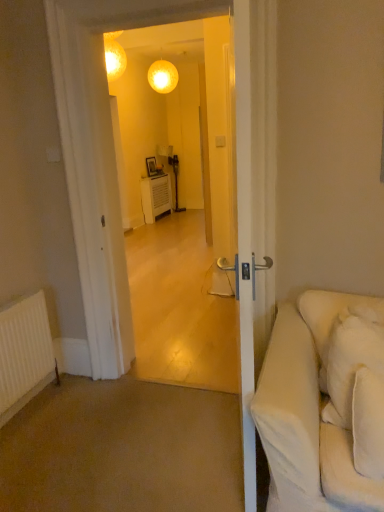
Locate an element on the screen. vacant region in front of white matte radiator at lower left is located at coordinates (38, 441).